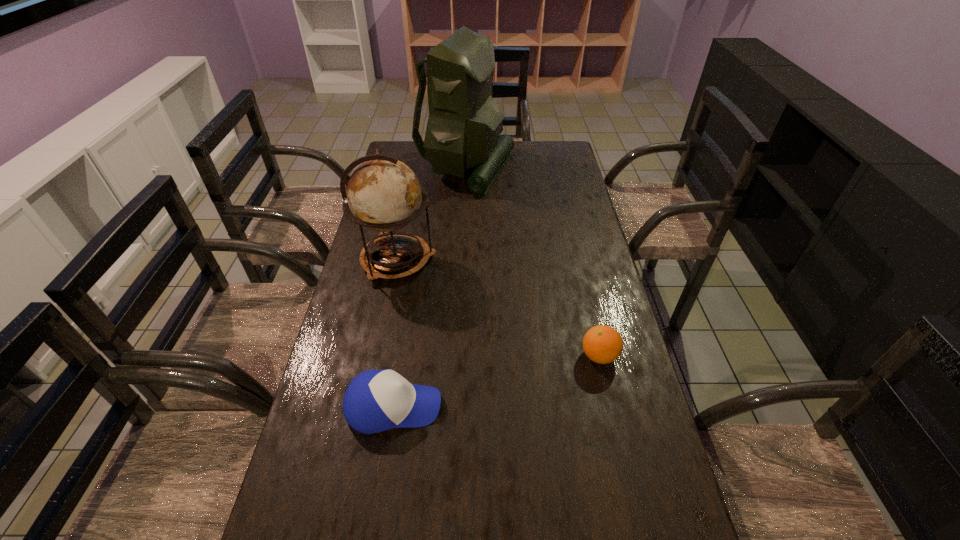
Find the location of `the tallest object`. the tallest object is located at coordinates (464, 123).

Find the location of `backpack`. backpack is located at coordinates (x=464, y=123).

The width and height of the screenshot is (960, 540). I want to click on the third nearest object, so click(384, 194).

Locate an element on the screen. globe is located at coordinates (384, 194).

Find the location of a particular element. The image size is (960, 540). baseball cap is located at coordinates (375, 400).

You are a GUI agent. You are given a task and a screenshot of the screen. Output one action in this format:
    pyautogui.click(x=<x>, y=<y>)
    Task: Click on the rightmost object
    This screenshot has height=540, width=960.
    Given the screenshot: What is the action you would take?
    pyautogui.click(x=602, y=344)

You are a GUI agent. You are given a task and a screenshot of the screen. Output one action in this format:
    pyautogui.click(x=<x>, y=<y>)
    Task: Click on the third farthest object
    
    Given the screenshot: What is the action you would take?
    pyautogui.click(x=602, y=344)

The image size is (960, 540). What are the coordinates of `vacant space located 0.190m on the front of the backpack with visible pockets` in the screenshot? It's located at (561, 167).

Where is `free space located 0.390m at the center of the globe`? The image size is (960, 540). free space located 0.390m at the center of the globe is located at coordinates (556, 260).

Find the location of a particular element. Image resolution: width=960 pixels, height=540 pixels. vacant area located 0.090m on the front-facing side of the nearest object is located at coordinates (479, 407).